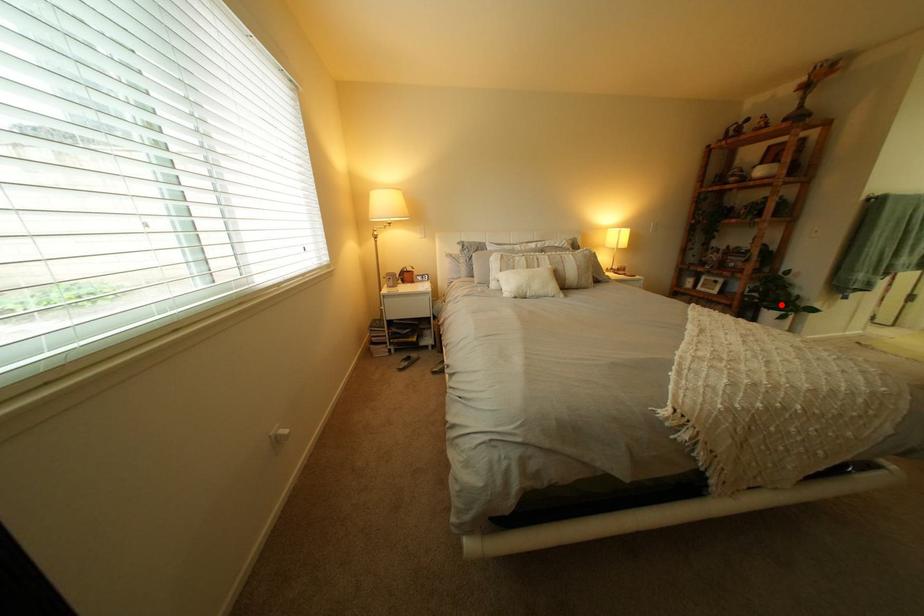
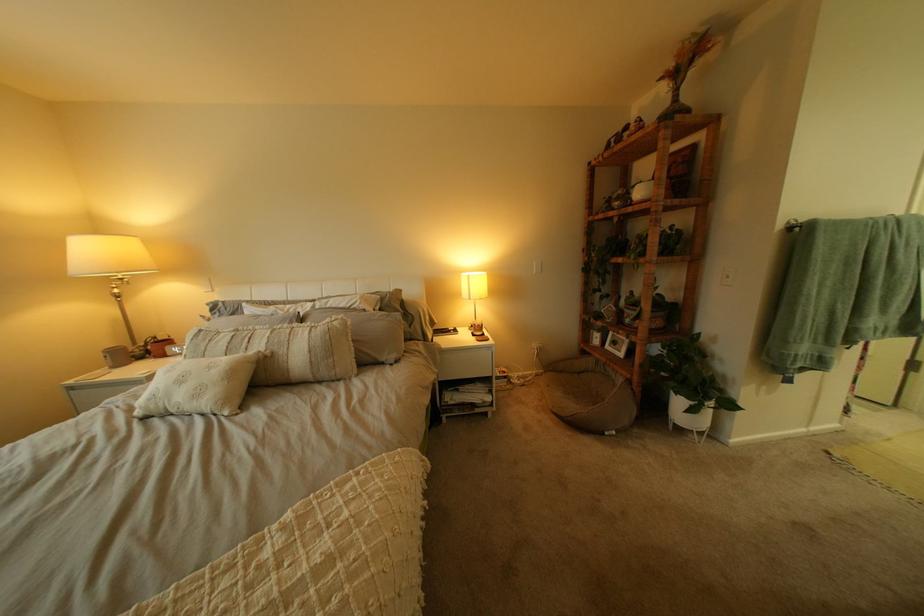
Find the pixel in the second image that matches the highlighted location in the first image.

(687, 385)